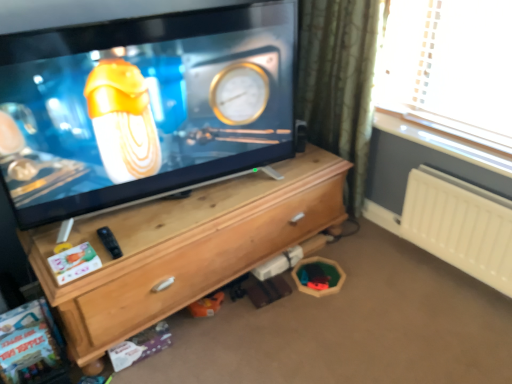
The height and width of the screenshot is (384, 512). In order to click on blank area beneath white plastic radiator at right (from a real-world perspective) in this screenshot , I will do `click(459, 273)`.